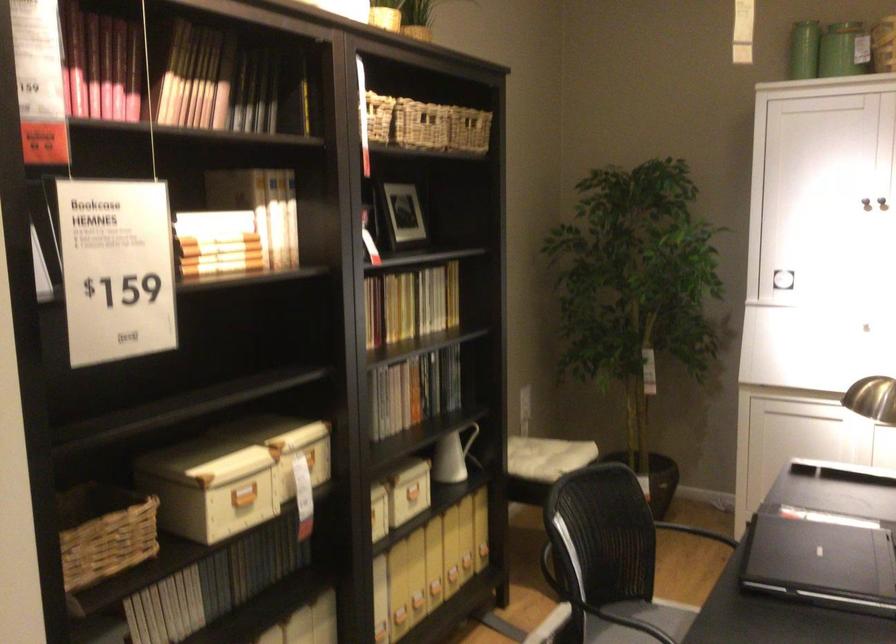
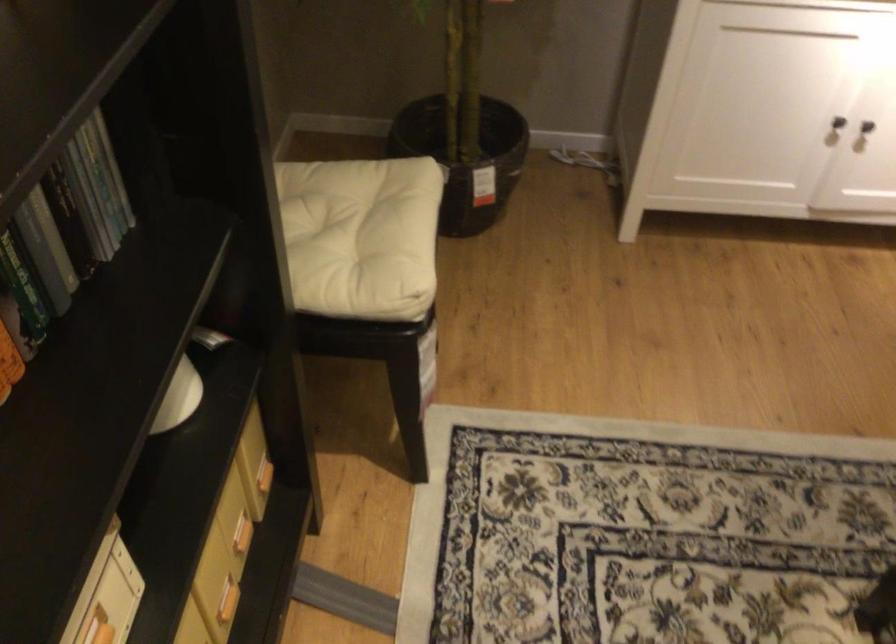
Locate, in the second image, the point that corresponds to point 478,551 in the first image.

(263, 476)